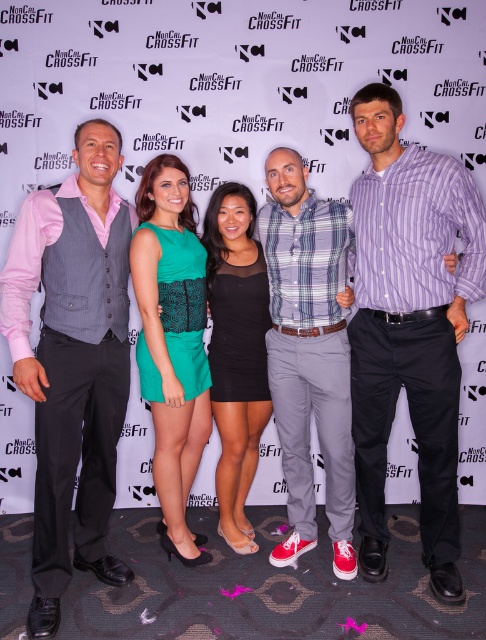
You are a photographer at the NorCal CrossFit event. You need to arrange the two dresses, the green textured dress at center and the black lace dress at center, into a display case that can only accommodate one of them. Which dress should you choose based on their widths?

The green textured dress at center is thinner than the black lace dress at center, so the green textured dress at center would fit better in the display case that can only accommodate one of them.

You are a photographer adjusting the lighting for the group photo. The green textured dress at center and the black lace dress at center are both in the frame. Which dress should you focus on first to ensure proper exposure since it is closer to the camera?

The green textured dress at center is closer to the viewer than the black lace dress at center, so you should focus on the green textured dress at center first to ensure proper exposure.

Looking at the NorCal CrossFit promotional photo, which of the two central figures is positioned to the right when comparing the plaid cotton shirt at center and the green textured dress at center?

The plaid cotton shirt at center is positioned to the right of the green textured dress at center.